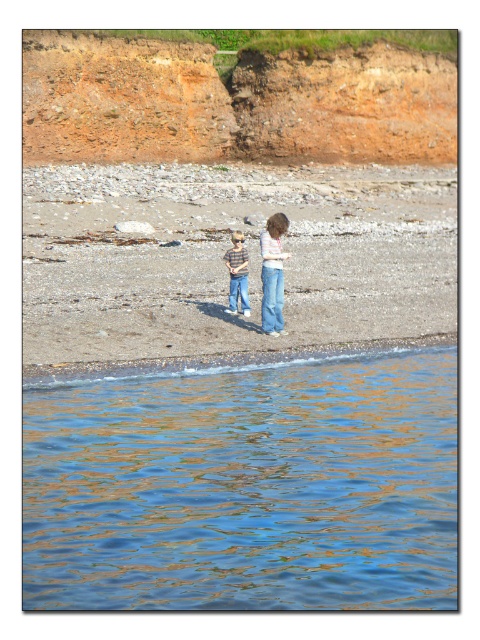
You are standing on the smooth sand beach at center and want to walk to the blue liquid water at lower left. Is the path directly in front of you going downhill or uphill?

The blue liquid water at lower left is below the smooth sand beach at center, so the path directly in front of you is going downhill.

You are standing on the rocky beach and see the smooth sand beach at center and the blue denim jeans at center. Which one is located to the right of the other?

The smooth sand beach at center is positioned on the right side of blue denim jeans at center.

You are planning to build a sandcastle on the beach. Based on the scene, which area would provide a more stable foundation for the structure? Please consider the materials available in the blue liquid water at lower left and the smooth sand beach at center.

The smooth sand beach at center provides a more stable foundation for the sandcastle because it has a solid surface, whereas the blue liquid water at lower left is fluid and cannot support structures.